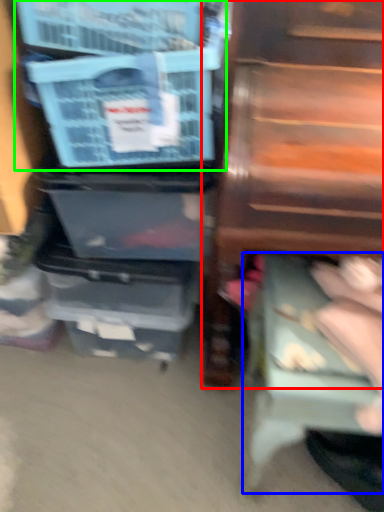
Question: Which is nearer to the furniture (highlighted by a red box)? step stool (highlighted by a blue box) or storage box (highlighted by a green box).

Choices:
 (A) step stool
 (B) storage box

Answer: (B)